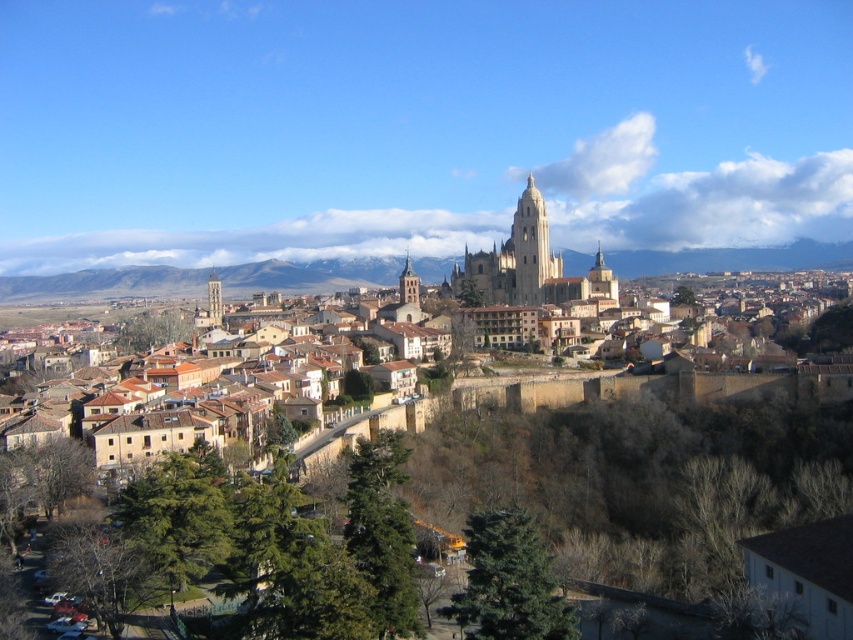
You are an architect visiting the city and want to take a photo of both the brown stone town at center and the gray stone cathedral at center. Based on their positions, which one should you focus on first to ensure both are in frame?

You should focus on the gray stone cathedral at center first because the brown stone town at center is to its left, so positioning the cathedral centrally will allow the town to be included in the frame to the left.